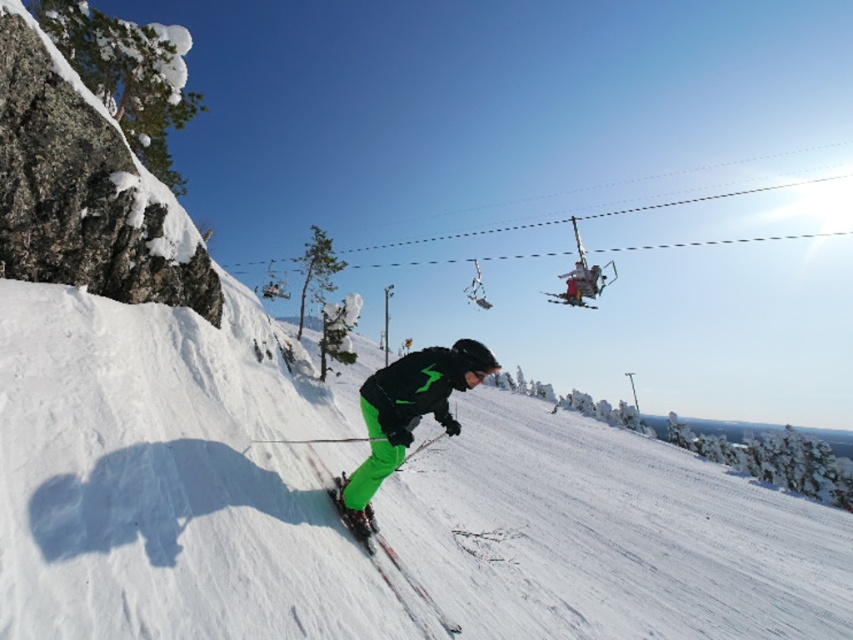
Between green matte ski slope at center and green matte ski at center, which one appears on the right side from the viewer's perspective?

From the viewer's perspective, green matte ski slope at center appears more on the right side.

What do you see at coordinates (169, 481) in the screenshot? I see `green matte ski slope at center` at bounding box center [169, 481].

The image size is (853, 640). I want to click on green matte ski slope at center, so click(169, 481).

Image resolution: width=853 pixels, height=640 pixels. In order to click on green matte snow pants at center in this screenshot , I will do `click(407, 413)`.

Is point (352, 529) farther from camera compared to point (373, 552)?

No, it is not.

At what (x,y) coordinates should I click in order to perform the action: click on green matte snow pants at center. Please return your answer as a coordinate pair (x, y). Looking at the image, I should click on [x=407, y=413].

Which is behind, point (238, 566) or point (405, 365)?

The point (405, 365) is more distant.

Does green matte ski slope at center have a smaller size compared to green matte snow pants at center?

No, green matte ski slope at center is not smaller than green matte snow pants at center.

Which is in front, point (814, 525) or point (459, 384)?

Point (459, 384) is in front.

Identify the location of green matte ski slope at center. This screenshot has width=853, height=640. (169, 481).